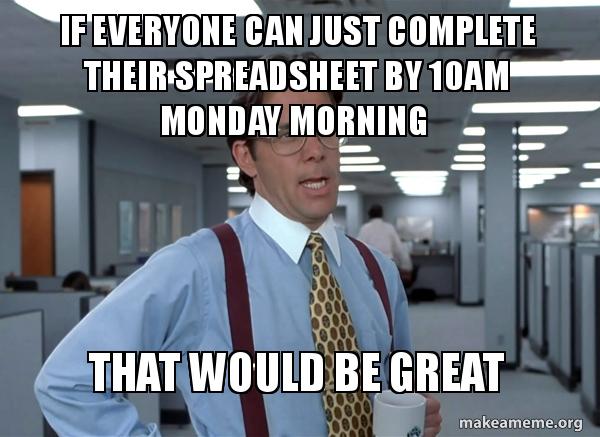
Locate an element on the screen. door is located at coordinates (33, 235).